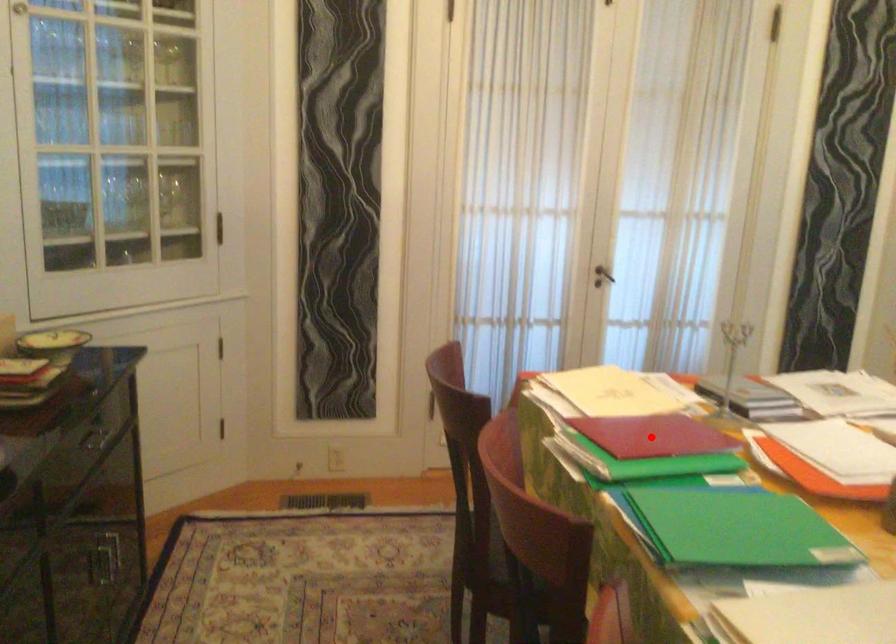
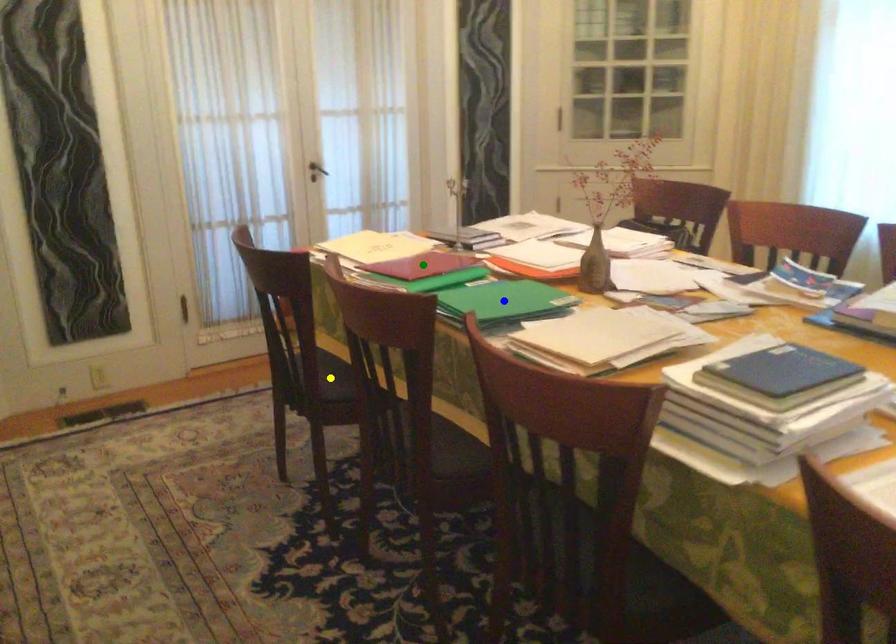
Question: I am providing you with two images of the same scene from different viewpoints. A red point is marked on the first image. You are given multiple points on the second image. Which mark in image 2 goes with the point in image 1?

Choices:
 (A) green point
 (B) blue point
 (C) yellow point

Answer: (A)